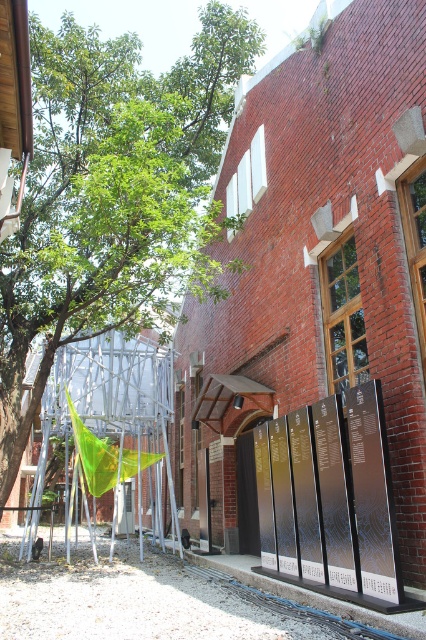
Question: Is green leafy tree at upper left wider than metallic silver sign at center?

Choices:
 (A) yes
 (B) no

Answer: (A)

Question: Which point is farther to the camera?

Choices:
 (A) (337, 596)
 (B) (138, 120)
 (C) (169, 609)

Answer: (B)

Question: Can you confirm if green leafy tree at upper left is smaller than metallic silver sign at center?

Choices:
 (A) yes
 (B) no

Answer: (B)

Question: Which point is closer to the camera taking this photo?

Choices:
 (A) (261, 592)
 (B) (268, 524)

Answer: (A)

Question: Does green leafy tree at upper left appear under metallic silver sign at center?

Choices:
 (A) no
 (B) yes

Answer: (A)

Question: Among these objects, which one is farthest from the camera?

Choices:
 (A) metallic silver sign at center
 (B) metallic signboards at lower center

Answer: (A)